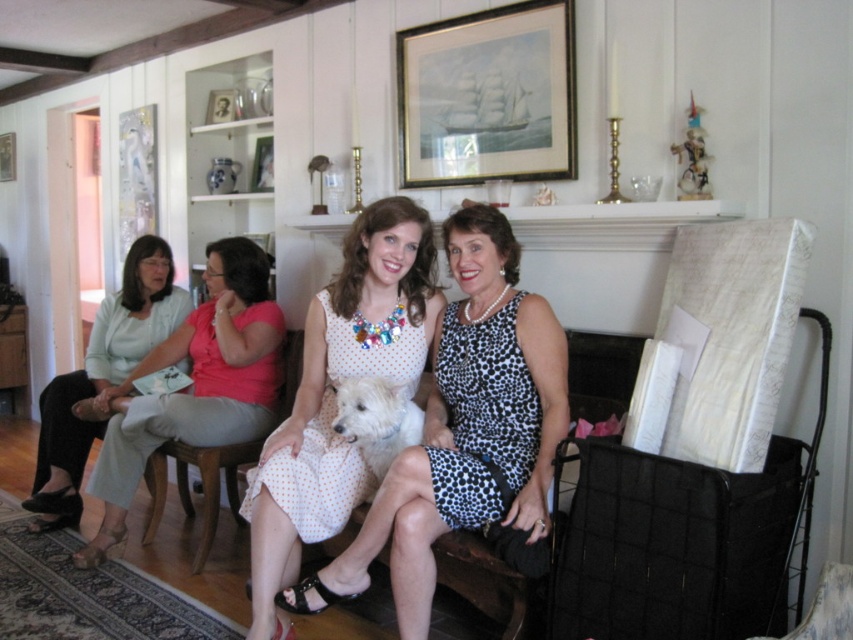
You are standing in the living room and see the two women sitting on the bench. There is a point marked at coordinates [102,376]. Which woman is wearing the light blue fabric dress?

The point at [102,376] marks the light blue fabric dress at left, so the woman on the left is wearing the light blue fabric dress.

You are a guest in this living room and want to take a photo of the white fur dog at center without including the brushed metal picture frame at upper center in the shot. How should you adjust your camera angle?

Lower your camera angle so that the white fur dog at center is framed below the brushed metal picture frame at upper center, ensuring the frame is out of the shot.

What are the coordinates of the white fur dog at center?

The white fur dog at center is located at coordinates point (376, 419).